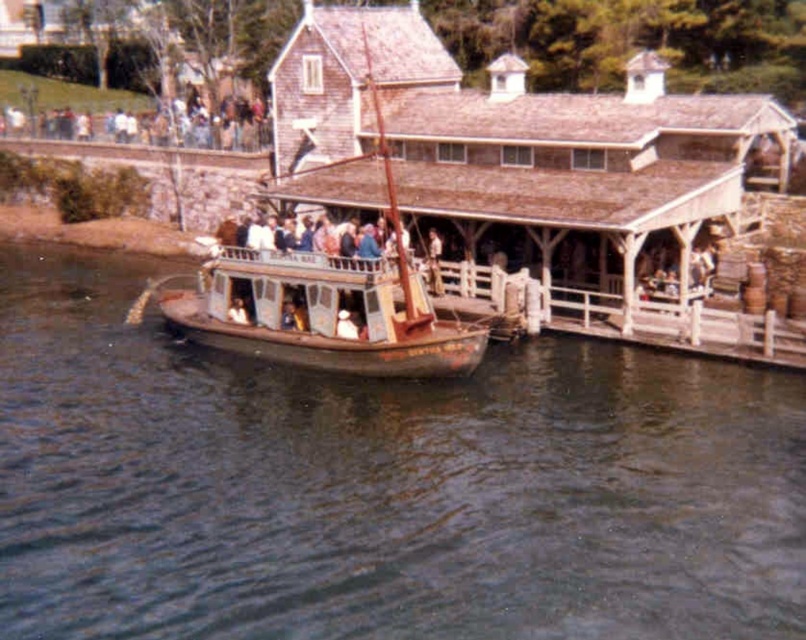
Question: Can you confirm if brown water at lower center is positioned to the right of rusty wooden boat at center?

Choices:
 (A) yes
 (B) no

Answer: (A)

Question: Which object appears farthest from the camera in this image?

Choices:
 (A) brown water at lower center
 (B) rusty wooden boat at center

Answer: (B)

Question: Among these points, which one is farthest from the camera?

Choices:
 (A) (368, 269)
 (B) (617, 605)

Answer: (A)

Question: Among these points, which one is farthest from the camera?

Choices:
 (A) (717, 525)
 (B) (339, 333)

Answer: (B)

Question: Can you confirm if brown water at lower center is positioned above rusty wooden boat at center?

Choices:
 (A) yes
 (B) no

Answer: (B)

Question: Does brown water at lower center have a greater width compared to rusty wooden boat at center?

Choices:
 (A) yes
 (B) no

Answer: (A)